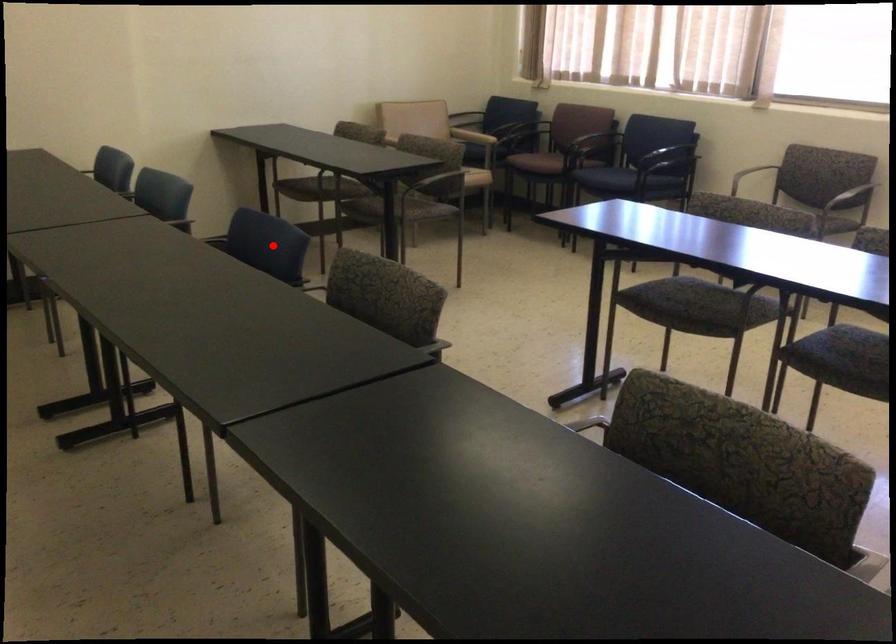
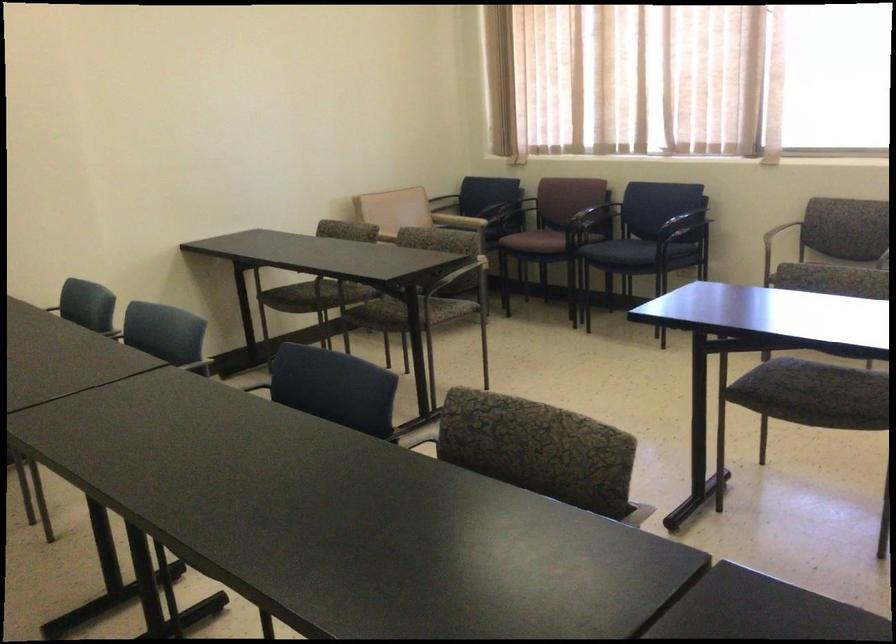
The point at the highlighted location is marked in the first image. Where is the corresponding point in the second image?

(332, 386)